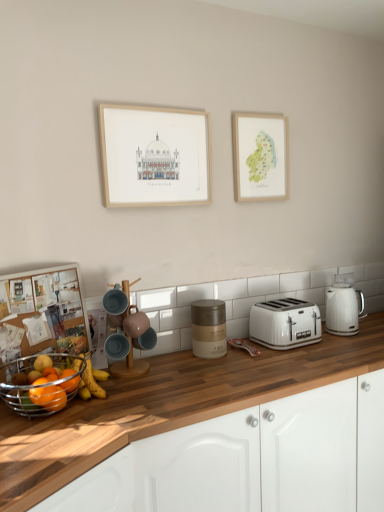
Where is `free spot in front of matte gold canister at center, positioned as the third appliance in left-to-right order`? This screenshot has height=512, width=384. free spot in front of matte gold canister at center, positioned as the third appliance in left-to-right order is located at coordinates (208, 368).